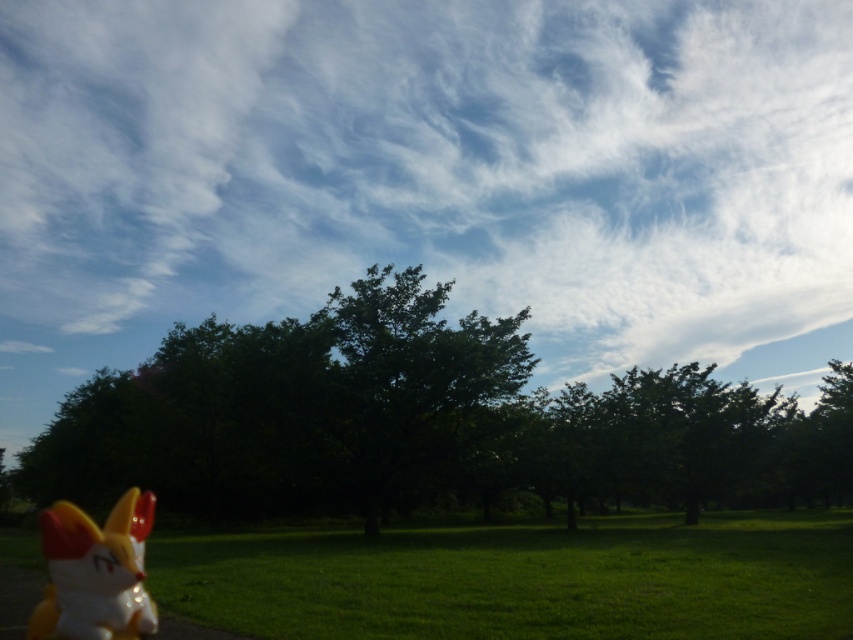
Can you confirm if white fluffy cloud at upper center is shorter than green leafy tree at center?

No.

In the scene shown: Who is shorter, white fluffy cloud at upper center or green leafy tree at center?

With less height is green leafy tree at center.

Is point (137, 68) positioned behind point (120, 445)?

Yes, point (137, 68) is behind point (120, 445).

Find the location of a particular element. white fluffy cloud at upper center is located at coordinates 427,177.

Which is in front, point (107, 307) or point (146, 499)?

Point (146, 499) is in front.

Is white fluffy cloud at upper center thinner than shiny plastic fox at lower left?

No, white fluffy cloud at upper center is not thinner than shiny plastic fox at lower left.

Is point (834, 138) behind point (78, 612)?

Yes, point (834, 138) is behind point (78, 612).

Locate an element on the screen. This screenshot has width=853, height=640. white fluffy cloud at upper center is located at coordinates (427, 177).

Between point (271, 326) and point (91, 538), which one is positioned behind?

Point (271, 326)

Is green leafy tree at center further to the viewer compared to shiny plastic fox at lower left?

Yes.

Is point (433, 458) closer to camera compared to point (74, 529)?

No, (433, 458) is further to viewer.

At what (x,y) coordinates should I click in order to perform the action: click on green leafy tree at center. Please return your answer as a coordinate pair (x, y). Looking at the image, I should click on (421, 422).